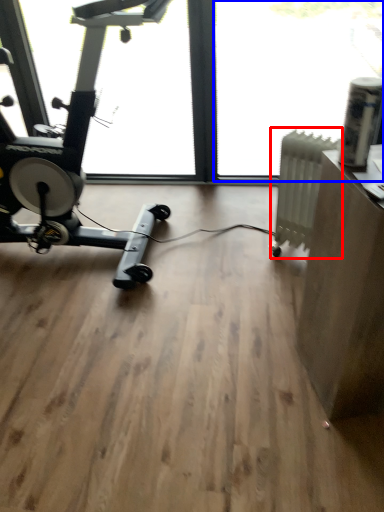
Question: Which object is closer to the camera taking this photo, radiator (highlighted by a red box) or window screen (highlighted by a blue box)?

Choices:
 (A) radiator
 (B) window screen

Answer: (A)